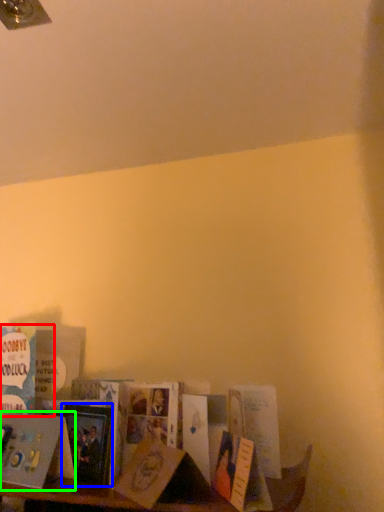
Question: Based on their relative distances, which object is farther from book (highlighted by a red box)? Choose from paperback book (highlighted by a blue box) and book (highlighted by a green box).

Choices:
 (A) paperback book
 (B) book

Answer: (A)